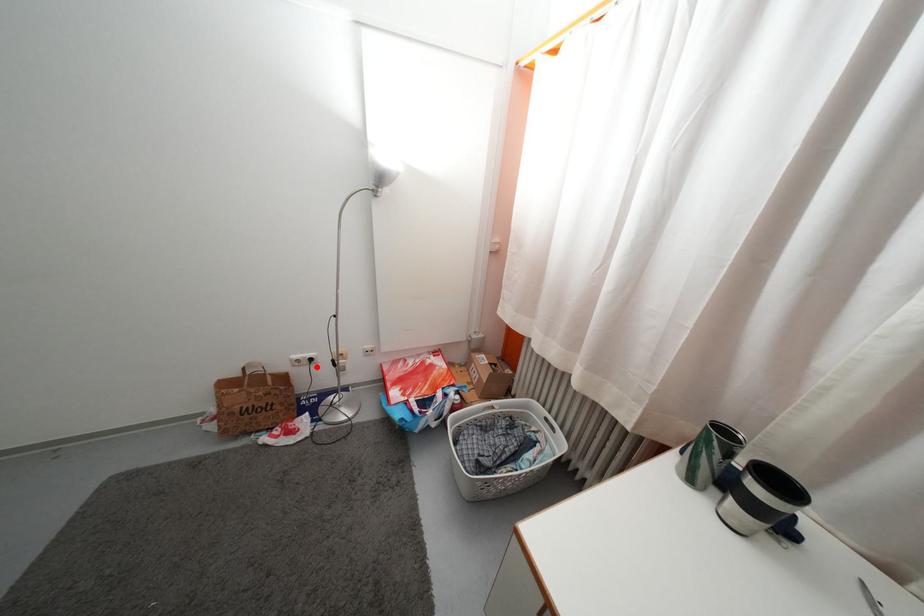
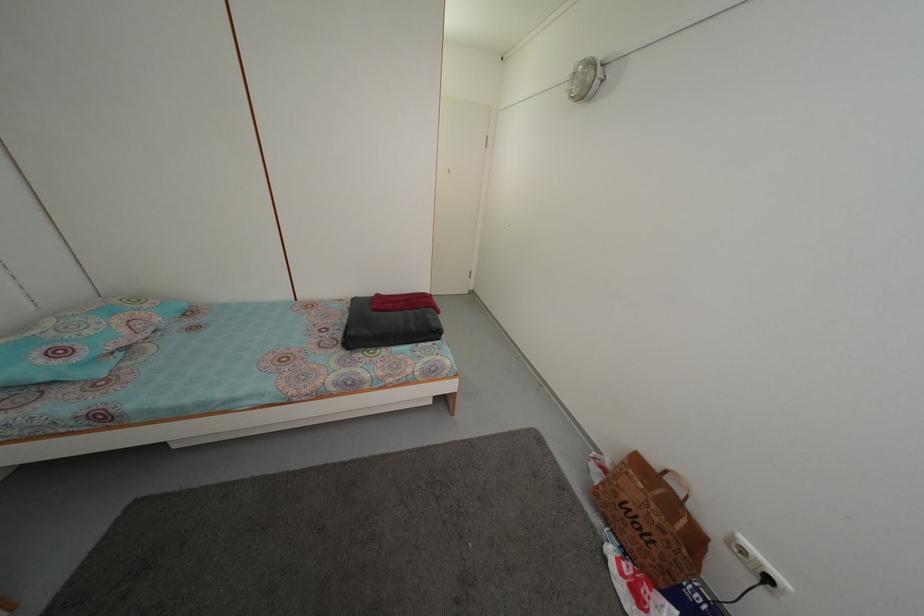
The point at the highlighted location is marked in the first image. Where is the corresponding point in the second image?

(774, 588)